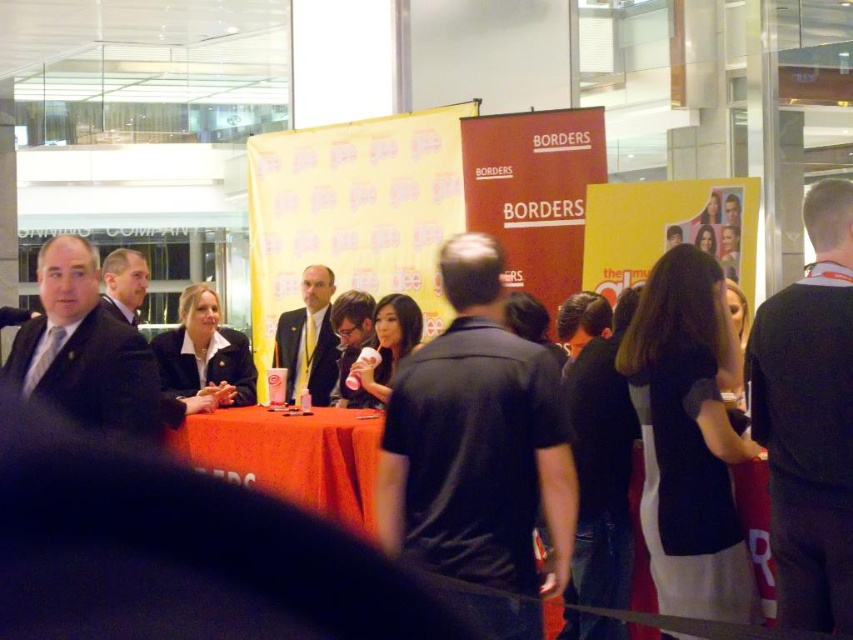
Question: Is black sweater at right wider than matte black suit at left?

Choices:
 (A) yes
 (B) no

Answer: (B)

Question: Observing the image, what is the correct spatial positioning of matte black suit at center in reference to dark gray suit at left?

Choices:
 (A) above
 (B) below

Answer: (A)

Question: Which of the following is the farthest from the observer?

Choices:
 (A) (306, 369)
 (B) (811, 272)

Answer: (A)

Question: Which object is positioned closest to the black matte shirt at center?

Choices:
 (A) dark gray suit at left
 (B) black fabric business suit at center
 (C) matte black suit at center
 (D) matte black suit at left

Answer: (B)

Question: Does black matte shirt at center appear under dark suit at center?

Choices:
 (A) yes
 (B) no

Answer: (A)

Question: Which of the following is the closest to the observer?

Choices:
 (A) (321, 474)
 (B) (786, 372)

Answer: (B)